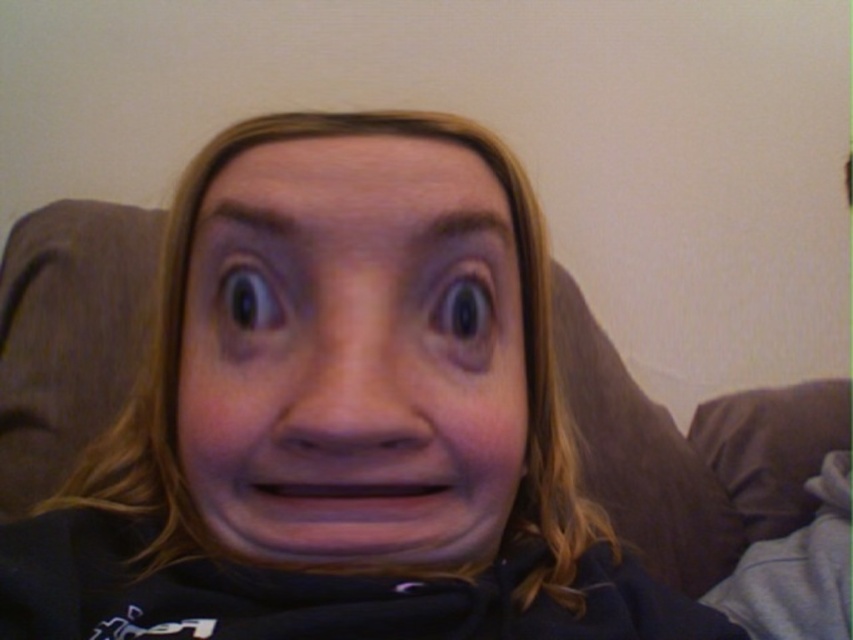
Measure the distance between shiny brown eye at center and camera.

shiny brown eye at center and camera are 12.50 inches apart.

Where is `shiny brown eye at center`? shiny brown eye at center is located at coordinates (462, 314).

Does matte black face at center appear on the left side of black glossy eye at upper left?

Yes, matte black face at center is to the left of black glossy eye at upper left.

Who is taller, matte black face at center or black glossy eye at upper left?

matte black face at center is taller.

Where is `matte black face at center`? The width and height of the screenshot is (853, 640). matte black face at center is located at coordinates (339, 422).

Who is lower down, smooth skin face at center or black glossy eye at upper left?

smooth skin face at center is below.

Between point (263, 445) and point (227, 323), which one is positioned in front?

Point (263, 445) is more forward.

The height and width of the screenshot is (640, 853). I want to click on smooth skin face at center, so click(352, 355).